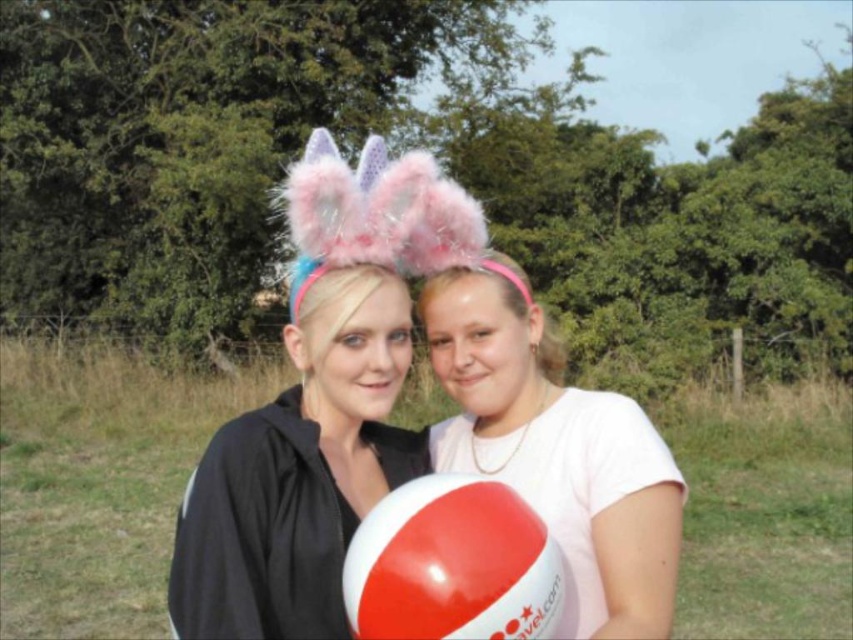
Does point (611, 506) come behind point (561, 604)?

Yes, it is behind point (561, 604).

Where is `white matte balloon at center`? white matte balloon at center is located at coordinates (556, 445).

Find the location of a particular element. white matte balloon at center is located at coordinates (556, 445).